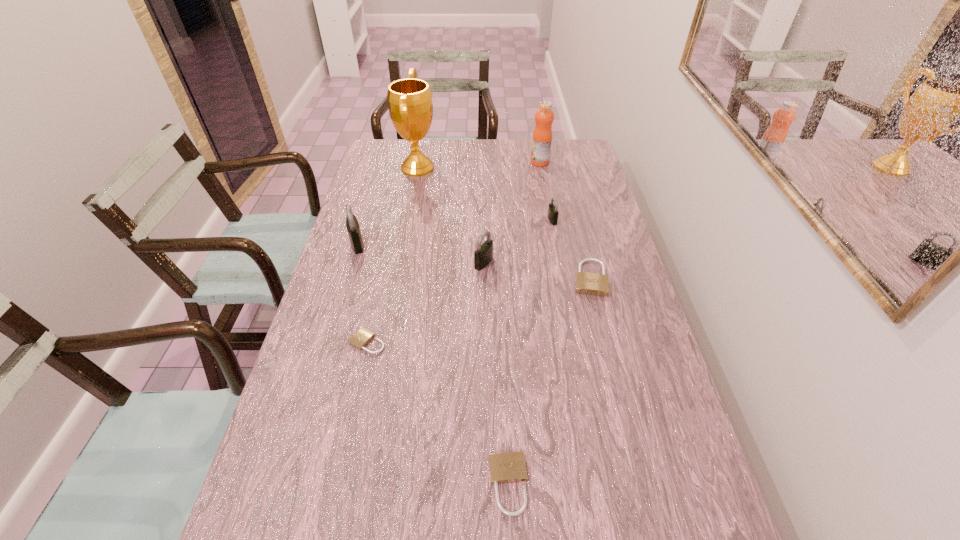
I want to click on the tallest object, so click(410, 105).

Identify the location of gold award. The image size is (960, 540). (410, 105).

Where is `fruit juice`? This screenshot has width=960, height=540. fruit juice is located at coordinates pos(542,136).

Image resolution: width=960 pixels, height=540 pixels. What are the coordinates of `the second nearest black padlock` in the screenshot? It's located at (352, 225).

This screenshot has width=960, height=540. Identify the location of the tallest padlock. (352, 225).

The width and height of the screenshot is (960, 540). Identify the location of the fifth shortest object. (483, 255).

Locate an element on the screen. the second smallest black padlock is located at coordinates click(x=483, y=255).

You are a GUI agent. You are given a task and a screenshot of the screen. Output one action in this format:
    pyautogui.click(x=<x>, y=<y>)
    Task: Click on the sixth nearest object
    The width and height of the screenshot is (960, 540).
    Given the screenshot: What is the action you would take?
    pyautogui.click(x=552, y=215)

The image size is (960, 540). I want to click on the fourth shortest padlock, so click(x=552, y=215).

I want to click on the biggest beige padlock, so click(x=588, y=283).